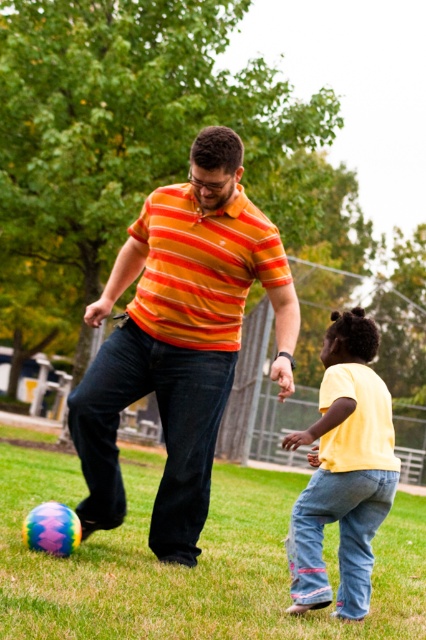
You are a photographer trying to capture both the orange striped shirt at center and the yellow matte shirt at lower right in a single shot. Which shirt should you adjust your camera focus to prioritize to ensure both are in frame?

The orange striped shirt at center is further to the viewer than the yellow matte shirt at lower right. To ensure both are in frame, focus on the orange striped shirt at center first, as it is closer, and adjust the camera angle to include the yellow matte shirt at lower right in the background.

In the scene, there are two people wearing shirts labeled as orange striped shirt at center and yellow matte shirt at lower right. Based on their positions and the description, which shirt is worn by the taller person?

The orange striped shirt at center is worn by the taller person since it has a greater height compared to the yellow matte shirt at lower right.

You are standing at the point with coordinates point [282,298] and want to throw a ball to the point [351,346]. Will you have to throw the ball forward or backward?

Since point [282,298] is behind point [351,346], you will have to throw the ball forward to reach point [351,346] from point [282,298].